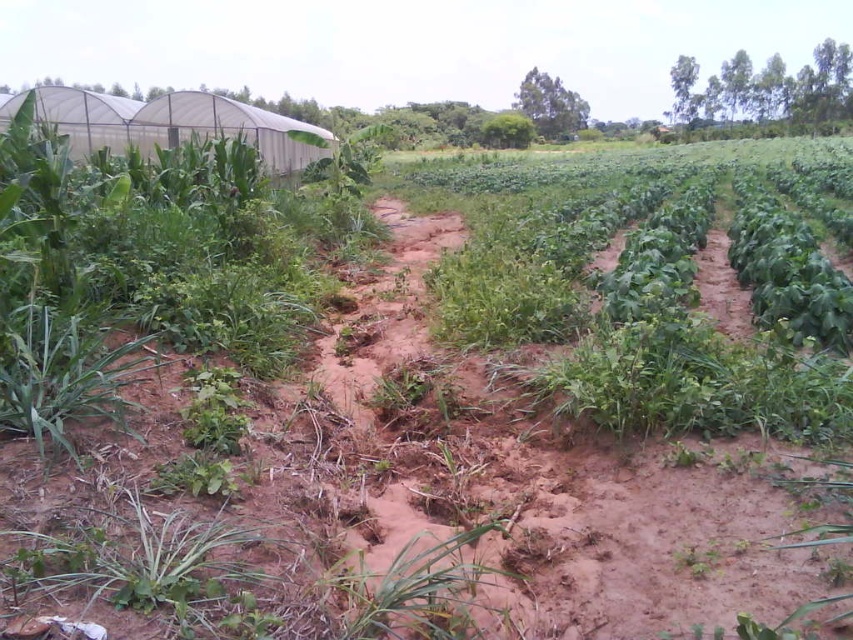
You are standing at the point marked by the coordinates point [152,570] in the image. What type of plant is immediately around you?

The point [152,570] indicates a green leafy plant at lower left.

You are a farmer checking the crops. You notice the green leafy plant at lower left and the green grass at center. Which one is nearer to you?

The green leafy plant at lower left is closer to the viewer than the green grass at center.